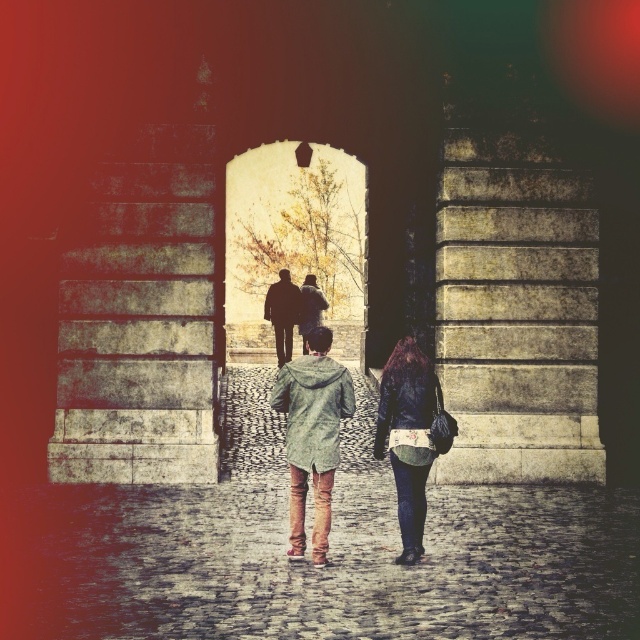
From the picture: You are standing at the entrance of the arched stone doorway and see two people walking away from you towards the archway. You notice a green textured coat at center and a silhouette leather jacket at center. Which person is closer to you?

The green textured coat at center is closer to the viewer than the silhouette leather jacket at center, so the person wearing the green textured coat at center is closer to you.